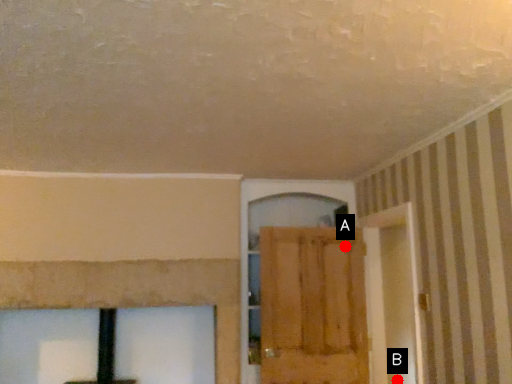
Question: Two points are circled on the image, labeled by A and B beside each circle. Which point is closer to the camera?

Choices:
 (A) A is closer
 (B) B is closer

Answer: (B)